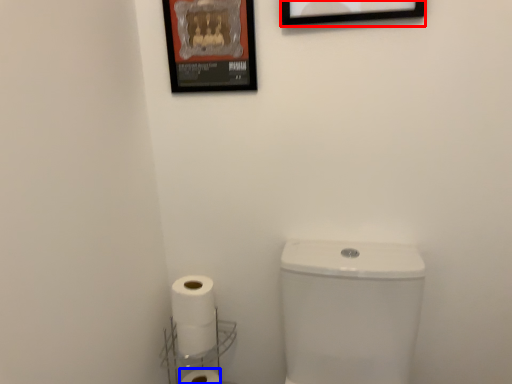
Question: Which of the following is the closest to the observer, picture frame (highlighted by a red box) or toilet paper (highlighted by a blue box)?

Choices:
 (A) picture frame
 (B) toilet paper

Answer: (A)